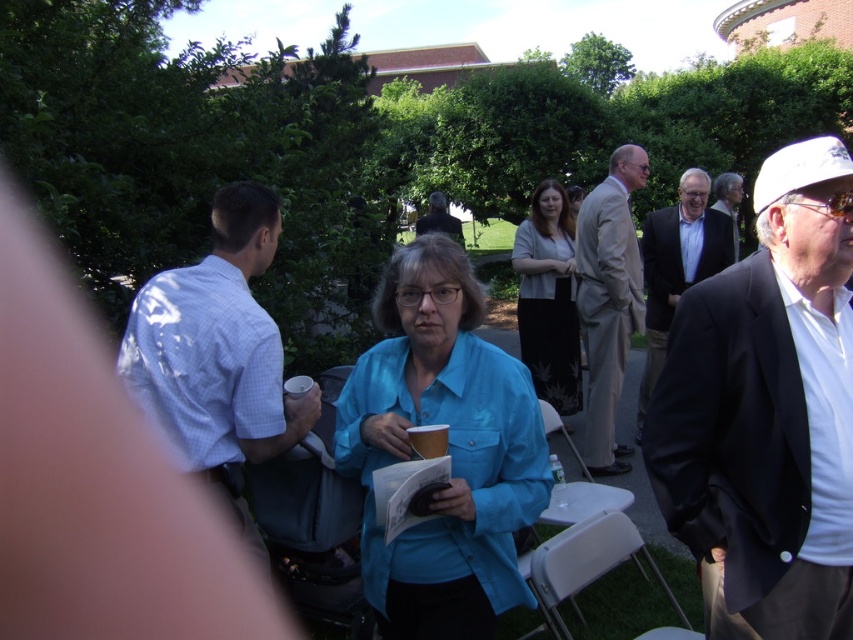
Who is more forward, (737, 195) or (447, 225)?

Point (737, 195) is more forward.

Can you confirm if light brown suit at center is positioned above dark gray suit at center?

Incorrect, light brown suit at center is not positioned above dark gray suit at center.

Which is behind, point (717, 193) or point (430, 202)?

The point (430, 202) is behind.

Locate an element on the screen. This screenshot has width=853, height=640. light brown suit at center is located at coordinates (728, 202).

Who is lower down, light gray cardigan at center or light brown suit at center?

light gray cardigan at center

In the scene shown: Between light gray cardigan at center and light brown suit at center, which one is positioned higher?

light brown suit at center is above.

Where is `light gray cardigan at center`? light gray cardigan at center is located at coordinates (548, 298).

Who is positioned more to the right, matte blue shirt at center or light blue shirt at center?

light blue shirt at center

In the scene shown: Does matte blue shirt at center have a lesser height compared to light blue shirt at center?

Yes.

Does point (437, 573) lie in front of point (672, 269)?

That is True.

I want to click on matte blue shirt at center, so click(x=448, y=449).